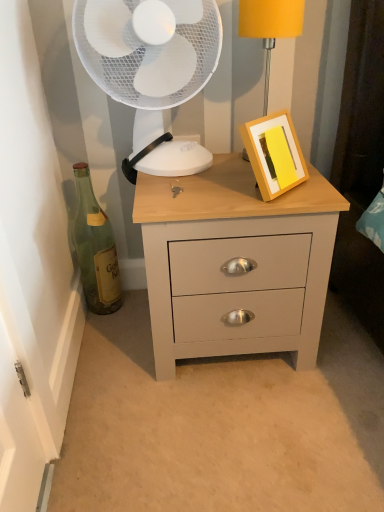
Identify the location of free space that is to the left of matte gray chest of drawers at center. pos(115,352).